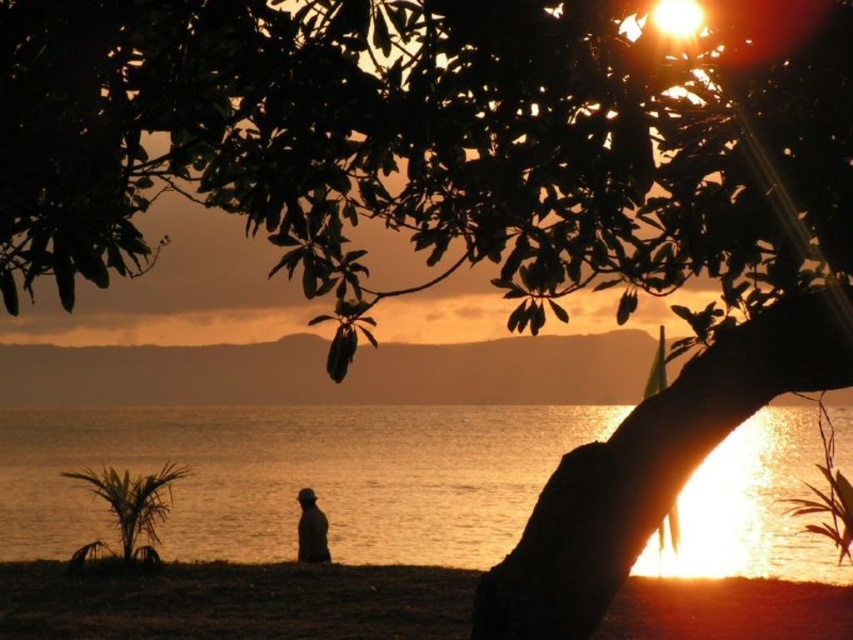
Question: Which of the following is the farthest from the observer?

Choices:
 (A) (308, 500)
 (B) (550, 452)

Answer: (A)

Question: Which of the following is the farthest from the observer?

Choices:
 (A) brown sand at lower center
 (B) golden reflective water at center
 (C) silhouette figure at lower center

Answer: (C)

Question: Based on their relative distances, which object is farther from the silhouette figure at lower center?

Choices:
 (A) brown sand at lower center
 (B) golden reflective water at center

Answer: (A)

Question: Is golden reflective water at center to the right of silhouette figure at lower center from the viewer's perspective?

Choices:
 (A) no
 (B) yes

Answer: (A)

Question: Is golden reflective water at center further to the viewer compared to silhouette figure at lower center?

Choices:
 (A) no
 (B) yes

Answer: (A)

Question: Does golden reflective water at center appear on the right side of silhouette figure at lower center?

Choices:
 (A) yes
 (B) no

Answer: (B)